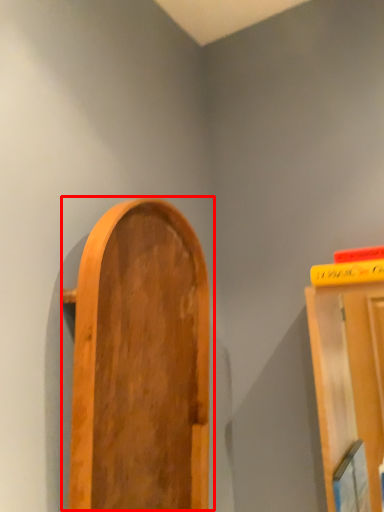
Question: Considering the relative positions of door (annotated by the red box) and book in the image provided, where is door (annotated by the red box) located with respect to the staircase?

Choices:
 (A) right
 (B) left

Answer: (B)